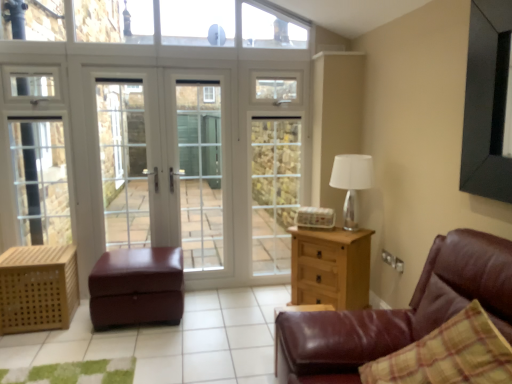
This screenshot has width=512, height=384. What are the coordinates of `free point above white glass screen door at left, which ranks as the 1th screen door in left-to-right order (from a real-world perspective)` in the screenshot? It's located at (118, 61).